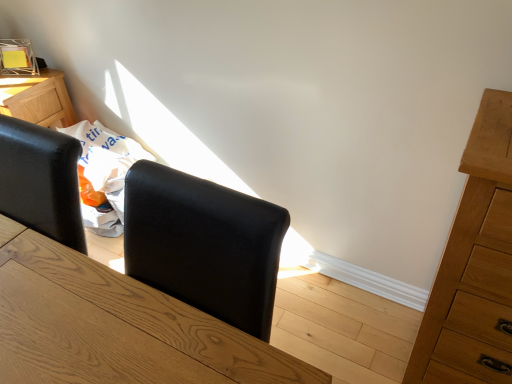
This screenshot has width=512, height=384. What do you see at coordinates (474, 266) in the screenshot?
I see `natural wood dresser at right` at bounding box center [474, 266].

Find the location of a particular element. natural wood dresser at right is located at coordinates (474, 266).

Measure the distance between natural wood dresser at right and camera.

natural wood dresser at right and camera are 90.00 centimeters apart from each other.

Identify the location of black leather armchair at center. The height and width of the screenshot is (384, 512). (204, 244).

Describe the element at coordinates (204, 244) in the screenshot. I see `black leather armchair at center` at that location.

Find the location of a particular element. natural wood dresser at right is located at coordinates (474, 266).

Between natural wood dresser at right and black leather armchair at center, which one appears on the left side from the viewer's perspective?

black leather armchair at center is more to the left.

Which object is further away from the camera, natural wood dresser at right or black leather armchair at center?

natural wood dresser at right is more distant.

Is point (462, 377) in front of point (236, 206)?

No, (462, 377) is further to viewer.

From the image's perspective, who appears lower, natural wood dresser at right or black leather armchair at center?

black leather armchair at center.

From a real-world perspective, is natural wood dresser at right positioned under black leather armchair at center based on gravity?

Yes, from a real-world perspective, natural wood dresser at right is below black leather armchair at center.

Between natural wood dresser at right and black leather armchair at center, which one has smaller width?

Thinner between the two is black leather armchair at center.

Considering the sizes of objects natural wood dresser at right and black leather armchair at center in the image provided, who is shorter, natural wood dresser at right or black leather armchair at center?

black leather armchair at center is shorter.

Considering the sizes of natural wood dresser at right and black leather armchair at center in the image, is natural wood dresser at right bigger or smaller than black leather armchair at center?

Considering their sizes, natural wood dresser at right takes up more space than black leather armchair at center.

Can black leather armchair at center be found inside natural wood dresser at right?

No, natural wood dresser at right does not contain black leather armchair at center.

Would you consider natural wood dresser at right to be distant from black leather armchair at center?

No, natural wood dresser at right is not far away from black leather armchair at center.

Is natural wood dresser at right oriented away from black leather armchair at center?

No, black leather armchair at center is not at the back of natural wood dresser at right.

How many degrees apart are the facing directions of natural wood dresser at right and black leather armchair at center?

There is a 1.02-degree angle between the facing directions of natural wood dresser at right and black leather armchair at center.

How distant is natural wood dresser at right from black leather armchair at center?

natural wood dresser at right and black leather armchair at center are 24.01 inches apart from each other.

This screenshot has width=512, height=384. Find the location of `armchair above the natural wood dresser at right (from a real-world perspective)`. armchair above the natural wood dresser at right (from a real-world perspective) is located at coordinates (204, 244).

Which is more to the left, black leather armchair at center or natural wood dresser at right?

From the viewer's perspective, black leather armchair at center appears more on the left side.

Is black leather armchair at center behind natural wood dresser at right?

No, it is in front of natural wood dresser at right.

Is point (203, 295) positioned in front of point (501, 99)?

That is True.

From the image's perspective, who appears lower, black leather armchair at center or natural wood dresser at right?

black leather armchair at center appears lower in the image.

From a real-world perspective, which is physically above, black leather armchair at center or natural wood dresser at right?

black leather armchair at center is physically above.

In the scene shown: Looking at their sizes, would you say black leather armchair at center is wider or thinner than natural wood dresser at right?

In the image, black leather armchair at center appears to be more narrow than natural wood dresser at right.

Is black leather armchair at center taller or shorter than natural wood dresser at right?

Considering their sizes, black leather armchair at center has less height than natural wood dresser at right.

Which of these two, black leather armchair at center or natural wood dresser at right, is smaller?

black leather armchair at center.

Is black leather armchair at center positioned beyond the bounds of natural wood dresser at right?

That's correct, black leather armchair at center is outside of natural wood dresser at right.

Would you say black leather armchair at center is a long distance from natural wood dresser at right?

No.

Is black leather armchair at center turned away from natural wood dresser at right?

black leather armchair at center does not have its back to natural wood dresser at right.

Consider the image. Can you tell me how much black leather armchair at center and natural wood dresser at right differ in facing direction?

The angular difference between black leather armchair at center and natural wood dresser at right is 1.02 degrees.

There is a natural wood dresser at right. What are the coordinates of `armchair above it (from a real-world perspective)` in the screenshot? It's located at (204, 244).

What are the coordinates of `chest of drawers behind the black leather armchair at center` in the screenshot? It's located at (474, 266).

Locate an element on the screen. This screenshot has height=384, width=512. armchair that is on the left side of natural wood dresser at right is located at coordinates (204, 244).